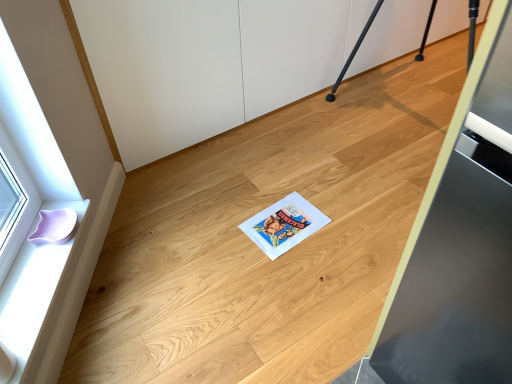
Locate an element on the screen. The width and height of the screenshot is (512, 384). white paper comic book at center is located at coordinates (284, 225).

The width and height of the screenshot is (512, 384). What do you see at coordinates (284, 225) in the screenshot? I see `white paper comic book at center` at bounding box center [284, 225].

I want to click on white paper comic book at center, so (284, 225).